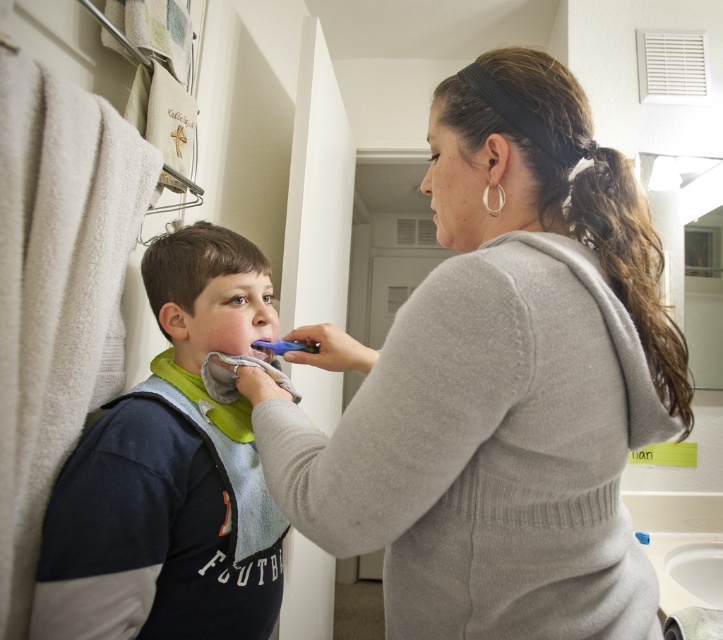
You are standing in the bathroom and want to reach the point marked at coordinates (500, 346). If your arm can extend 20 inches, will you be able to reach it?

The point at coordinates (500, 346) is 21.73 inches away from you, which is slightly beyond your arm reach of 20 inches. Therefore, you cannot reach it.

Consider the image. You are a photographer setting up a shoot in this bathroom. You need to position a small lamp so that it illuminates the dark blue cotton shirt at left without casting a shadow on the smooth skin at center. Is this possible given their current positions?

The dark blue cotton shirt at left is in front of the smooth skin at center, so placing the lamp in a position where its light can reach the shirt without the skin blocking it would require angling the light source around the shirt. However, since the shirt is in front, any light directed towards it would likely cast a shadow on the skin behind it. Therefore, it might not be possible to illuminate the shirt without casting a shadow on the skin.